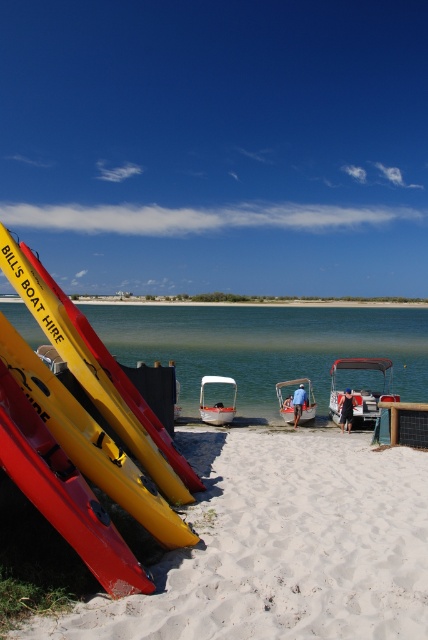
Is matte yellow kayak at left above white plastic boat at center?

Yes, matte yellow kayak at left is above white plastic boat at center.

Does point (65, 419) come farther from viewer compared to point (285, 397)?

That is False.

The height and width of the screenshot is (640, 428). In order to click on matte yellow kayak at left in this screenshot , I will do `click(83, 435)`.

At what (x,y) coordinates should I click in order to perform the action: click on matte yellow kayak at left. Please return your answer as a coordinate pair (x, y). Looking at the image, I should click on (83, 435).

Is point (149, 584) positioned after point (237, 308)?

No, it is in front of (237, 308).

Who is higher up, matte yellow kayak at left or green smooth water at center?

green smooth water at center

Where is `matte yellow kayak at left`? matte yellow kayak at left is located at coordinates (83, 435).

Can you confirm if white sandy beach at lower left is positioned to the right of matte yellow kayak at left?

Indeed, white sandy beach at lower left is positioned on the right side of matte yellow kayak at left.

Does point (382, 480) come in front of point (112, 595)?

No, (382, 480) is further to viewer.

Is point (394, 612) behind point (42, 294)?

No, it is in front of (42, 294).

In order to click on white sandy beach at lower left in this screenshot , I will do `click(282, 547)`.